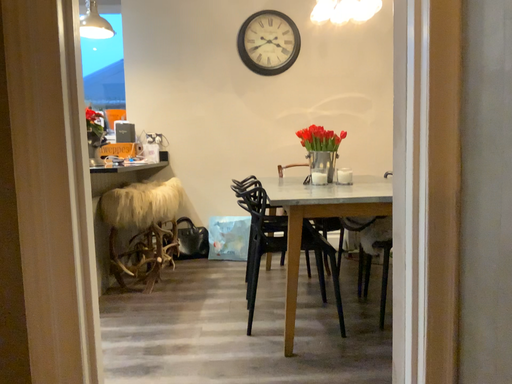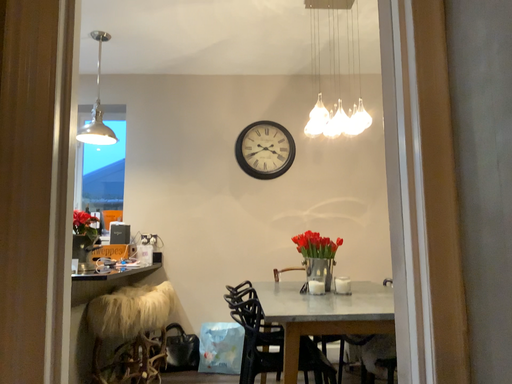
Question: Which way did the camera rotate in the video?

Choices:
 (A) rotated upward
 (B) rotated downward

Answer: (A)